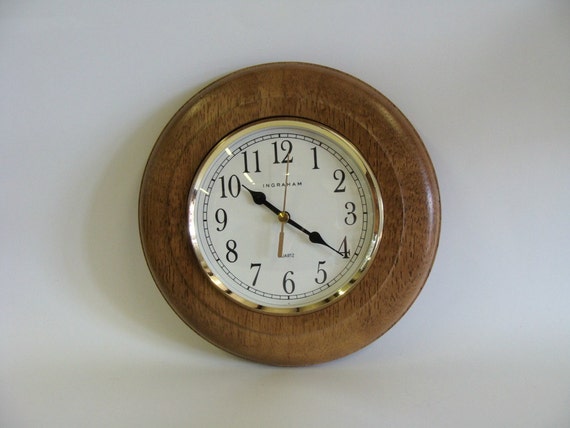
This screenshot has width=570, height=428. Identify the location of clock. (315, 206).